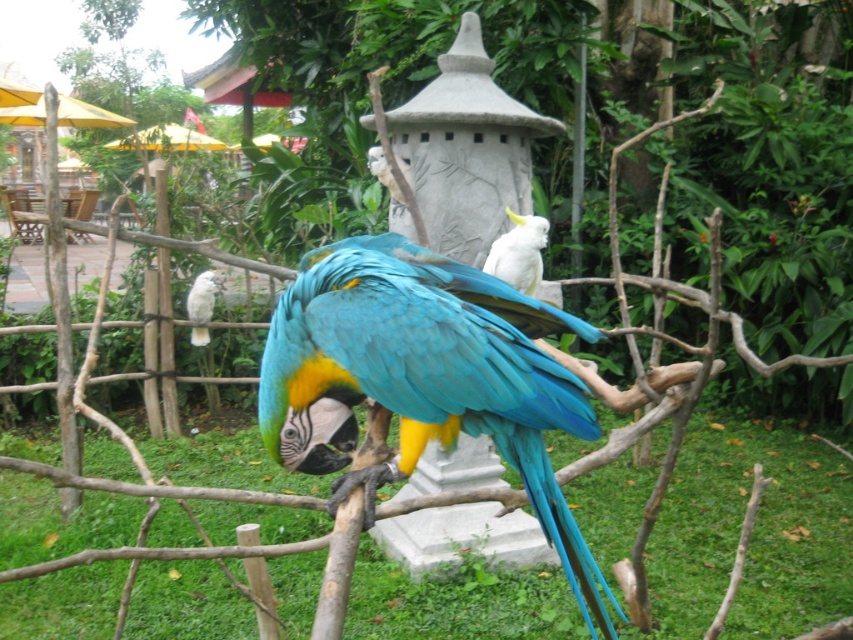
Question: Which point is closer to the camera?

Choices:
 (A) (283, 401)
 (B) (535, 284)

Answer: (A)

Question: Which object is positioned closest to the blue glossy parrot at center?

Choices:
 (A) white feathered parrot at center
 (B) white matte parrot at center

Answer: (B)

Question: Is blue glossy parrot at center behind white feathered parrot at center?

Choices:
 (A) yes
 (B) no

Answer: (B)

Question: Is white matte parrot at center bigger than white feathered parrot at center?

Choices:
 (A) no
 (B) yes

Answer: (B)

Question: Where is blue glossy parrot at center located in relation to white matte parrot at center in the image?

Choices:
 (A) left
 (B) right

Answer: (A)

Question: Estimate the real-world distances between objects in this image. Which object is farther from the white matte parrot at center?

Choices:
 (A) white feathered parrot at center
 (B) blue glossy parrot at center

Answer: (A)